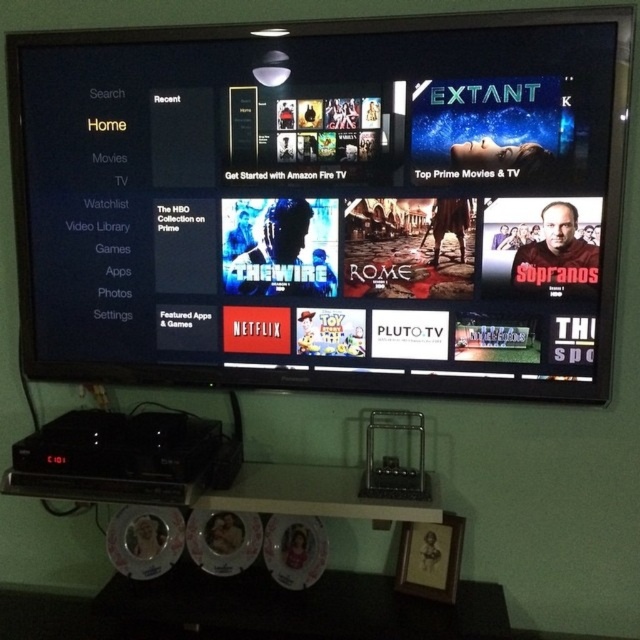
Question: Which object is farther from the camera taking this photo?

Choices:
 (A) matte plastic dvd at lower center
 (B) white glossy dvd at lower left
 (C) black glossy tv at upper center
 (D) white glossy dvd at lower center

Answer: (B)

Question: Can you confirm if black glossy tv at upper center is smaller than matte plastic dvd at lower center?

Choices:
 (A) yes
 (B) no

Answer: (B)

Question: Which point appears farthest from the camera in this image?

Choices:
 (A) (145, 529)
 (B) (198, 529)

Answer: (A)

Question: Observing the image, what is the correct spatial positioning of white glossy dvd at lower left in reference to white glossy dvd at lower center?

Choices:
 (A) above
 (B) below

Answer: (B)

Question: Which object appears farthest from the camera in this image?

Choices:
 (A) white glossy dvd at lower left
 (B) matte plastic dvd at lower center

Answer: (A)

Question: Does matte plastic dvd at lower center appear on the right side of white glossy dvd at lower center?

Choices:
 (A) yes
 (B) no

Answer: (B)